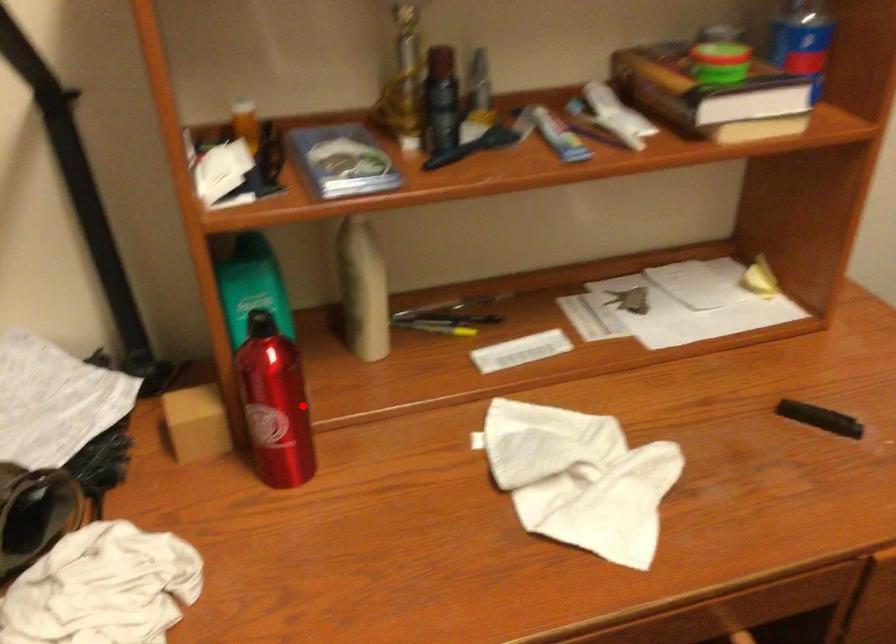
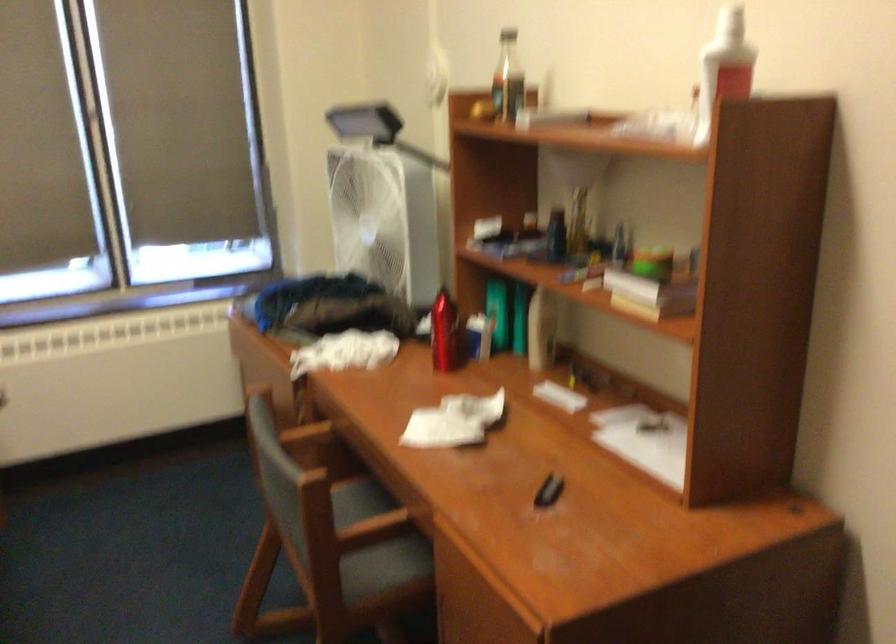
Question: I am providing you with two images of the same scene from different viewpoints. Given a red point in image1, look at the same physical point in image2. Is it:

Choices:
 (A) Closer to the viewpoint
 (B) Farther from the viewpoint

Answer: (B)